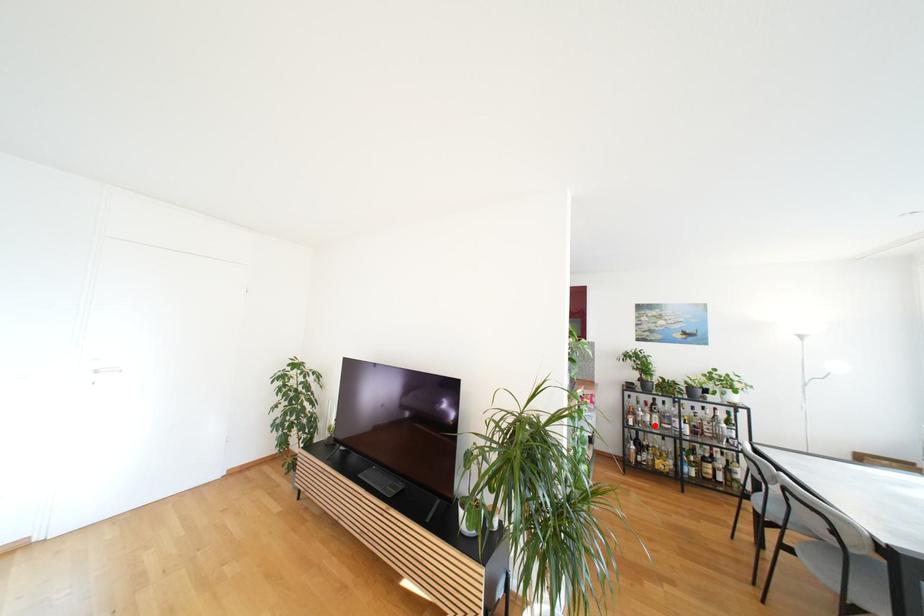
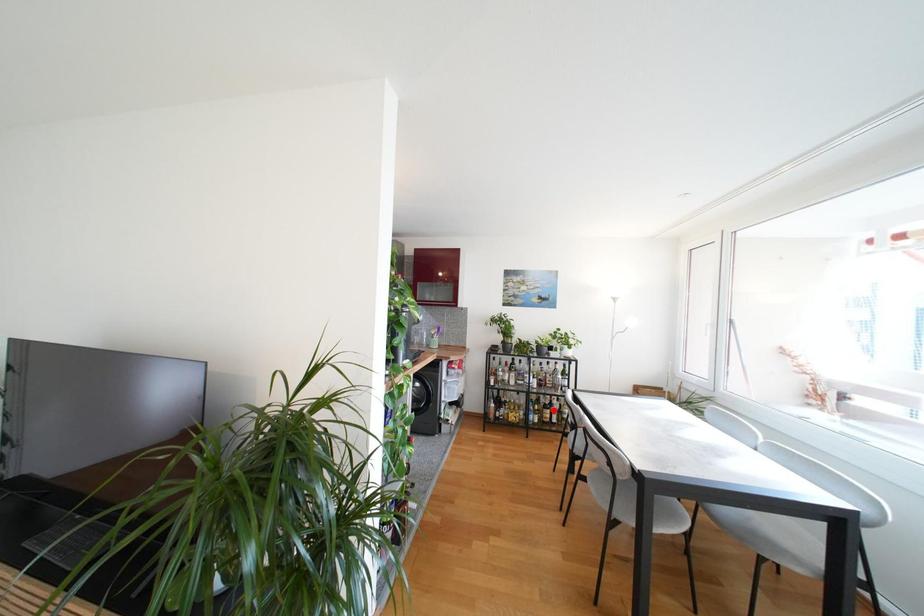
I am providing you with two images of the same scene from different viewpoints. A red point is marked on the first image and another point is marked on the second image. Is the marked point in image1 the same physical position as the marked point in image2?

No